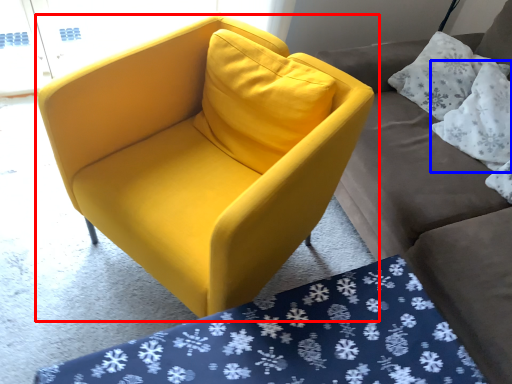
Question: Which object appears closest to the camera in this image, chair (highlighted by a red box) or pillow (highlighted by a blue box)?

Choices:
 (A) chair
 (B) pillow

Answer: (A)